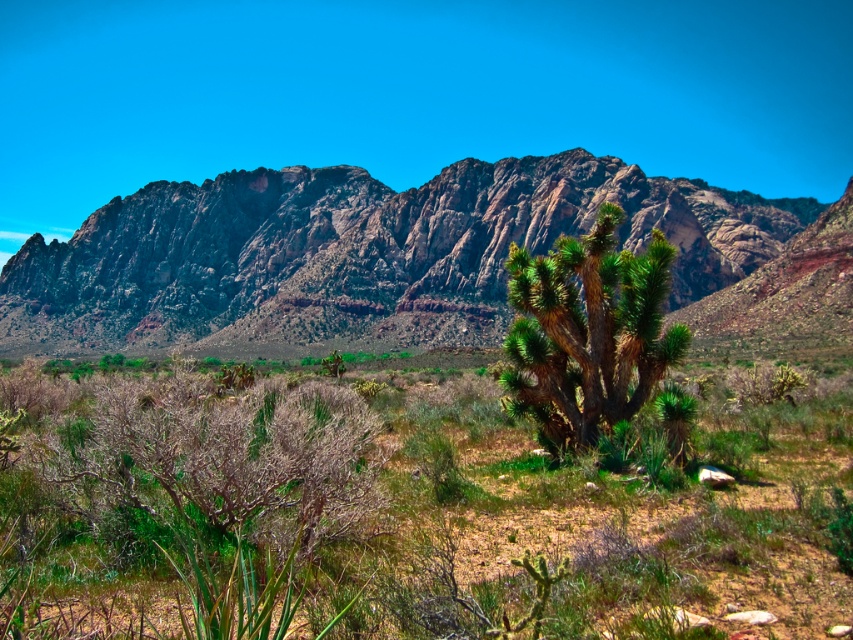
Question: Does green leafy bush at center appear under rugged rock mountain range at upper center?

Choices:
 (A) yes
 (B) no

Answer: (A)

Question: Can you confirm if green leafy bush at center is positioned below rugged rock mountain range at upper center?

Choices:
 (A) no
 (B) yes

Answer: (B)

Question: In this image, where is rugged rock mountain range at upper center located relative to green spiky cactus at center?

Choices:
 (A) above
 (B) below

Answer: (A)

Question: Estimate the real-world distances between objects in this image. Which object is closer to the green leafy bush at center?

Choices:
 (A) green spiky cactus at center
 (B) rugged rock mountain range at upper center

Answer: (A)

Question: Which of the following is the farthest from the observer?

Choices:
 (A) (283, 397)
 (B) (631, 317)
 (C) (674, 307)

Answer: (C)

Question: Which of the following is the farthest from the observer?

Choices:
 (A) rugged rock mountain range at upper center
 (B) green leafy bush at center
 (C) green spiky cactus at center

Answer: (A)